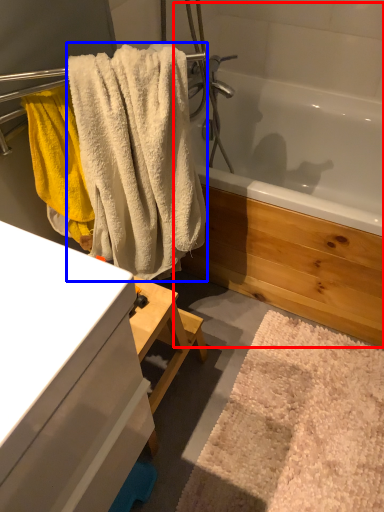
Question: Which object is closer to the camera taking this photo, jacuzzi (highlighted by a red box) or towel (highlighted by a blue box)?

Choices:
 (A) jacuzzi
 (B) towel

Answer: (B)